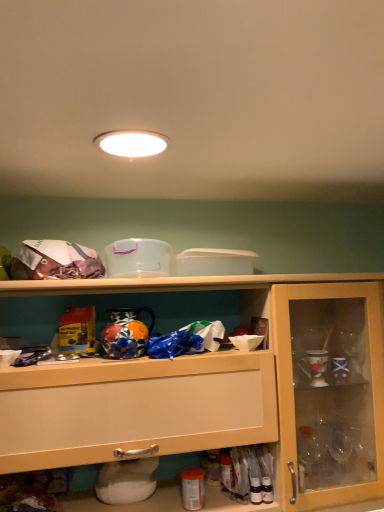
This screenshot has height=512, width=384. What do you see at coordinates (227, 397) in the screenshot?
I see `wooden cabinet at center` at bounding box center [227, 397].

Locate an element on the screen. The height and width of the screenshot is (512, 384). wooden cabinet at center is located at coordinates (227, 397).

The image size is (384, 512). Describe the element at coordinates (131, 143) in the screenshot. I see `white glossy light fixture at upper center` at that location.

At what (x,y) coordinates should I click in order to perform the action: click on white glossy light fixture at upper center. Please return your answer as a coordinate pair (x, y). Image resolution: width=384 pixels, height=512 pixels. Looking at the image, I should click on (131, 143).

Where is `wooden cabinet at center`? The width and height of the screenshot is (384, 512). wooden cabinet at center is located at coordinates (227, 397).

Between wooden cabinet at center and white glossy light fixture at upper center, which one appears on the left side from the viewer's perspective?

white glossy light fixture at upper center.

Is the depth of wooden cabinet at center greater than that of white glossy light fixture at upper center?

Yes, wooden cabinet at center is further from the camera.

Does point (337, 464) come farther from viewer compared to point (110, 139)?

Yes.

From the image's perspective, is wooden cabinet at center beneath white glossy light fixture at upper center?

Indeed, from the image's perspective, wooden cabinet at center is shown beneath white glossy light fixture at upper center.

From a real-world perspective, is wooden cabinet at center over white glossy light fixture at upper center?

Actually, wooden cabinet at center is physically below white glossy light fixture at upper center in the real world.

Consider the image. Does wooden cabinet at center have a lesser width compared to white glossy light fixture at upper center?

In fact, wooden cabinet at center might be wider than white glossy light fixture at upper center.

Does wooden cabinet at center have a lesser height compared to white glossy light fixture at upper center?

Incorrect, the height of wooden cabinet at center does not fall short of that of white glossy light fixture at upper center.

Who is smaller, wooden cabinet at center or white glossy light fixture at upper center?

white glossy light fixture at upper center.

Which is correct: wooden cabinet at center is inside white glossy light fixture at upper center, or outside of it?

wooden cabinet at center cannot be found inside white glossy light fixture at upper center.

Is wooden cabinet at center in contact with white glossy light fixture at upper center?

wooden cabinet at center and white glossy light fixture at upper center are clearly separated.

Is wooden cabinet at center turned away from white glossy light fixture at upper center?

That's not correct — wooden cabinet at center is not looking away from white glossy light fixture at upper center.

Locate an element on the screen. The width and height of the screenshot is (384, 512). cabinetry that is below the white glossy light fixture at upper center (from the image's perspective) is located at coordinates (227, 397).

Consider the image. Is white glossy light fixture at upper center to the right of wooden cabinet at center from the viewer's perspective?

No, white glossy light fixture at upper center is not to the right of wooden cabinet at center.

Considering the relative positions of white glossy light fixture at upper center and wooden cabinet at center in the image provided, is white glossy light fixture at upper center behind wooden cabinet at center?

No, it is in front of wooden cabinet at center.

Which is nearer, (x=151, y=137) or (x=366, y=307)?

The point (x=151, y=137) is in front.

From the image's perspective, which is below, white glossy light fixture at upper center or wooden cabinet at center?

wooden cabinet at center.

From a real-world perspective, which is physically below, white glossy light fixture at upper center or wooden cabinet at center?

wooden cabinet at center.

Considering the sizes of white glossy light fixture at upper center and wooden cabinet at center in the image, is white glossy light fixture at upper center wider or thinner than wooden cabinet at center?

In the image, white glossy light fixture at upper center appears to be more narrow than wooden cabinet at center.

Considering the sizes of objects white glossy light fixture at upper center and wooden cabinet at center in the image provided, who is taller, white glossy light fixture at upper center or wooden cabinet at center?

Standing taller between the two is wooden cabinet at center.

In terms of size, does white glossy light fixture at upper center appear bigger or smaller than wooden cabinet at center?

Considering their sizes, white glossy light fixture at upper center takes up less space than wooden cabinet at center.

Is wooden cabinet at center located within white glossy light fixture at upper center?

That's incorrect, wooden cabinet at center is not inside white glossy light fixture at upper center.

Does white glossy light fixture at upper center touch wooden cabinet at center?

white glossy light fixture at upper center and wooden cabinet at center are not in contact.

In the scene shown: Is white glossy light fixture at upper center positioned with its back to wooden cabinet at center?

white glossy light fixture at upper center is not turned away from wooden cabinet at center.

How many degrees apart are the facing directions of white glossy light fixture at upper center and wooden cabinet at center?

89.2 degrees separate the facing orientations of white glossy light fixture at upper center and wooden cabinet at center.

At what (x,y) coordinates should I click in order to perform the action: click on lighting located in front of the wooden cabinet at center. Please return your answer as a coordinate pair (x, y). Looking at the image, I should click on (131, 143).

Identify the location of cabinetry on the right of white glossy light fixture at upper center. [x=227, y=397].

The width and height of the screenshot is (384, 512). What are the coordinates of `cabinetry behind the white glossy light fixture at upper center` in the screenshot? It's located at (227, 397).